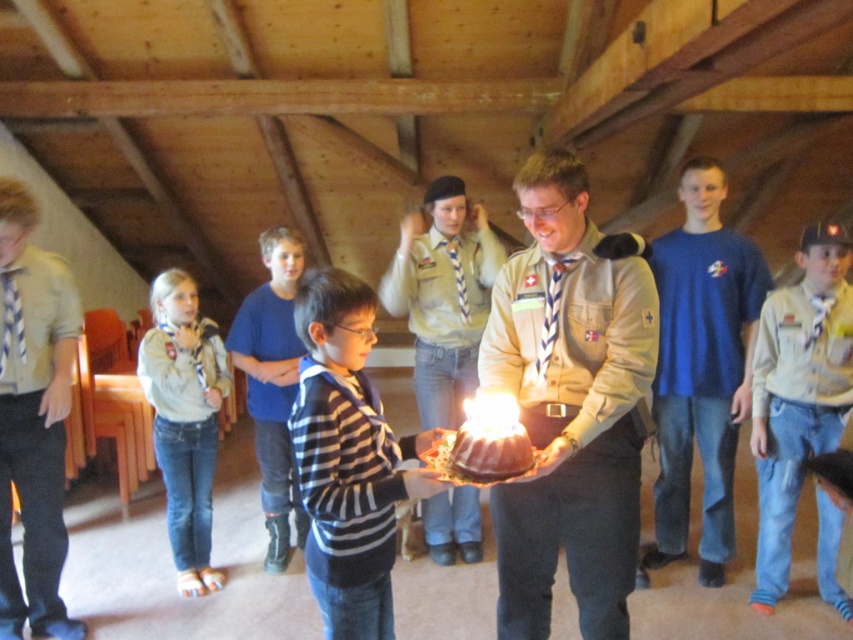
Question: Does blue cotton shirt at center come behind denim jeans at left?

Choices:
 (A) no
 (B) yes

Answer: (A)

Question: Does matte khaki uniform at center lie behind denim jeans at lower right?

Choices:
 (A) yes
 (B) no

Answer: (B)

Question: Which point is closer to the camera taking this photo?

Choices:
 (A) (836, 433)
 (B) (456, 218)

Answer: (A)

Question: From the image, what is the correct spatial relationship of blue cotton shirt at center in relation to striped cotton shirt at center?

Choices:
 (A) left
 (B) right

Answer: (B)

Question: Which object is positioned closest to the denim jeans at left?

Choices:
 (A) black striped sweater at center
 (B) blue cotton shirt at center
 (C) matte khaki uniform at center

Answer: (A)

Question: Estimate the real-world distances between objects in this image. Which object is farther from the matte khaki uniform at center?

Choices:
 (A) denim jeans at left
 (B) blue cotton shirt at center
 (C) denim jeans at lower right
 (D) light brown uniform at center

Answer: (D)